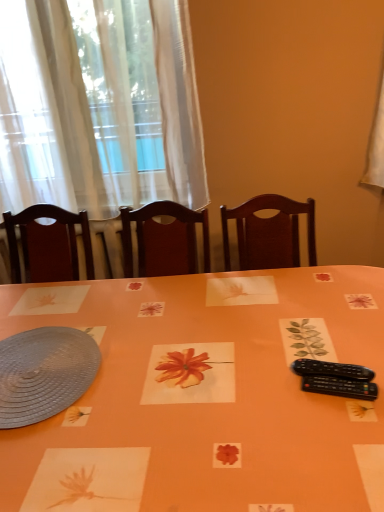
Question: Considering the relative sizes of white sheer curtain at upper left and orange paper placemat at center in the image provided, is white sheer curtain at upper left wider than orange paper placemat at center?

Choices:
 (A) yes
 (B) no

Answer: (B)

Question: Considering the relative sizes of white sheer curtain at upper left and orange paper placemat at center in the image provided, is white sheer curtain at upper left bigger than orange paper placemat at center?

Choices:
 (A) no
 (B) yes

Answer: (A)

Question: Is white sheer curtain at upper left turned away from orange paper placemat at center?

Choices:
 (A) yes
 (B) no

Answer: (B)

Question: Is white sheer curtain at upper left smaller than orange paper placemat at center?

Choices:
 (A) yes
 (B) no

Answer: (A)

Question: From a real-world perspective, is white sheer curtain at upper left on orange paper placemat at center?

Choices:
 (A) no
 (B) yes

Answer: (B)

Question: From the image's perspective, is white sheer curtain at upper left above orange paper placemat at center?

Choices:
 (A) no
 (B) yes

Answer: (B)

Question: Can you confirm if matte gray platter at lower left is taller than black plastic remote at lower right?

Choices:
 (A) no
 (B) yes

Answer: (A)

Question: Would you say matte gray platter at lower left is a long distance from black plastic remote at lower right?

Choices:
 (A) no
 (B) yes

Answer: (A)

Question: Is matte gray platter at lower left not inside black plastic remote at lower right?

Choices:
 (A) no
 (B) yes

Answer: (B)

Question: Does matte gray platter at lower left come in front of black plastic remote at lower right?

Choices:
 (A) yes
 (B) no

Answer: (B)

Question: Is matte gray platter at lower left placed right next to black plastic remote at lower right?

Choices:
 (A) yes
 (B) no

Answer: (B)

Question: From a real-world perspective, is matte gray platter at lower left located beneath black plastic remote at lower right?

Choices:
 (A) yes
 (B) no

Answer: (A)

Question: Considering the relative sizes of white sheer curtain at upper left and black plastic remote at lower right in the image provided, is white sheer curtain at upper left thinner than black plastic remote at lower right?

Choices:
 (A) no
 (B) yes

Answer: (A)